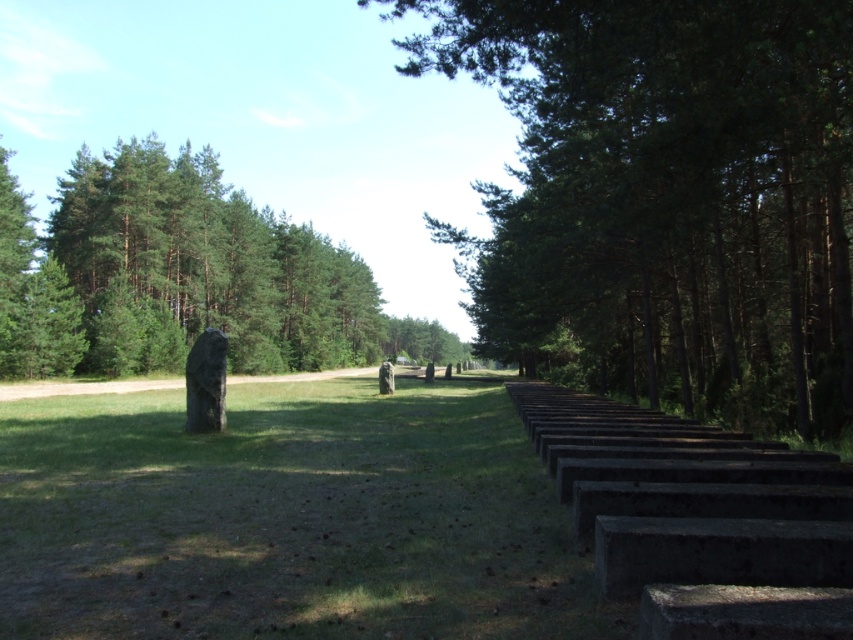
You are a landscape architect designing a walking path that must pass between the green leafy trees at center and the green grass at center. Which side should the path be closer to ensure it remains visible against the background?

The path should be closer to the green leafy trees at center because they are bigger than the green grass at center, making them a better backdrop for visibility.

You are a gardener planning to water the green grass at center and the green matte tree at left. Which one should you water first if you want to start from the left side of the scene?

You should water the green matte tree at left first since it is located to the left of the green grass at center.